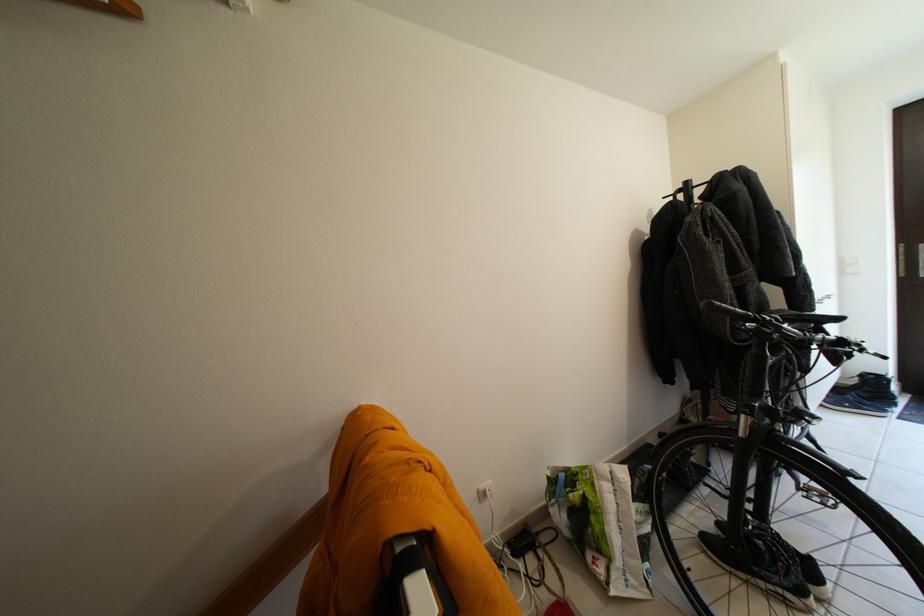
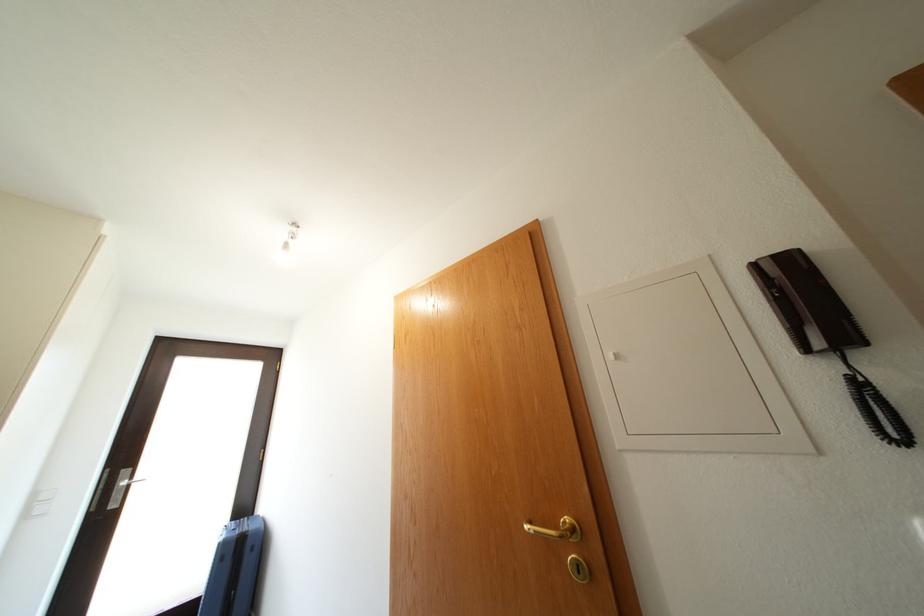
In the second image, find the point that corresponds to (x=850, y=278) in the first image.

(33, 522)